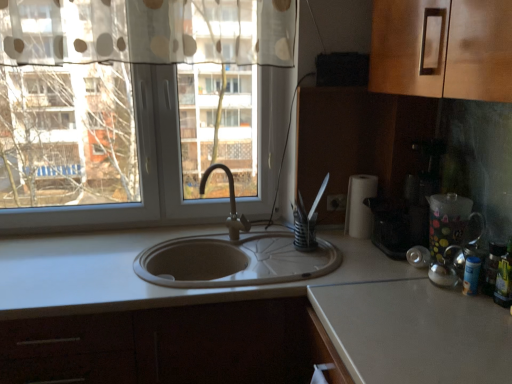
The width and height of the screenshot is (512, 384). What do you see at coordinates (408, 207) in the screenshot? I see `black plastic coffee machine at right` at bounding box center [408, 207].

I want to click on matte silver faucet at center, so click(x=230, y=203).

In the scene shown: In order to face matte silver faucet at center, should I rotate leftwards or rightwards?

You should look left and rotate roughly 4.015 degrees.

Locate an element on the screen. This screenshot has width=512, height=384. white matte countertop at center is located at coordinates (244, 318).

At what (x,y) coordinates should I click in order to perform the action: click on green glass bottle at right. Please return your answer as a coordinate pair (x, y). Looking at the image, I should click on [504, 279].

From the image's perspective, relative to white paper towel at right, is green glass bottle at right above or below?

Clearly, from the image's perspective, green glass bottle at right is below white paper towel at right.

Is green glass bottle at right not close to white paper towel at right?

No, green glass bottle at right is in close proximity to white paper towel at right.

Locate an element on the screen. The height and width of the screenshot is (384, 512). bottle below the white paper towel at right (from the image's perspective) is located at coordinates (504, 279).

From the picture: Which object is more forward, green glass bottle at right or white paper towel at right?

green glass bottle at right.

Consider the image. Could you tell me if white paper towel at right is turned towards matte silver faucet at center?

Yes, white paper towel at right is facing matte silver faucet at center.

Would you say white paper towel at right is outside matte silver faucet at center?

Indeed, white paper towel at right is completely outside matte silver faucet at center.

Is white paper towel at right with matte silver faucet at center?

No, white paper towel at right is not next to matte silver faucet at center.

Considering the sizes of objects white paper towel at right and matte silver faucet at center in the image provided, who is shorter, white paper towel at right or matte silver faucet at center?

With less height is white paper towel at right.

Locate an element on the screen. paper towel that appears behind the black plastic coffee machine at right is located at coordinates (360, 206).

Is white paper towel at right bigger than black plastic coffee machine at right?

No, white paper towel at right is not bigger than black plastic coffee machine at right.

Does white paper towel at right have a greater width compared to black plastic coffee machine at right?

Incorrect, the width of white paper towel at right does not surpass that of black plastic coffee machine at right.

Is white paper towel at right far away from black plastic coffee machine at right?

Actually, white paper towel at right and black plastic coffee machine at right are a little close together.

Is transparent plastic pitcher at right oriented away from white matte countertop at center?

No, transparent plastic pitcher at right is not facing the opposite direction of white matte countertop at center.

Does transparent plastic pitcher at right have a lesser height compared to white matte countertop at center?

Indeed, transparent plastic pitcher at right has a lesser height compared to white matte countertop at center.

Locate an element on the screen. This screenshot has height=384, width=512. countertop in front of the transparent plastic pitcher at right is located at coordinates (244, 318).

Can we say transparent plastic pitcher at right lies outside white matte countertop at center?

Yes, transparent plastic pitcher at right is not within white matte countertop at center.

Considering the relative sizes of white matte countertop at center and green glass bottle at right in the image provided, is white matte countertop at center taller than green glass bottle at right?

Correct, white matte countertop at center is much taller as green glass bottle at right.

Is white matte countertop at center next to green glass bottle at right and touching it?

They are not placed beside each other.

Based on their positions, is white matte countertop at center located to the left or right of green glass bottle at right?

white matte countertop at center is to the left of green glass bottle at right.

From the image's perspective, who appears lower, white matte countertop at center or green glass bottle at right?

white matte countertop at center appears lower in the image.

From a real-world perspective, who is located higher, green glass bottle at right or black plastic coffee machine at right?

black plastic coffee machine at right.

Which of these two, green glass bottle at right or black plastic coffee machine at right, stands taller?

black plastic coffee machine at right.

Is green glass bottle at right further to the viewer compared to black plastic coffee machine at right?

No, green glass bottle at right is closer to the viewer.

Where is `bottle that is in front of the black plastic coffee machine at right`? bottle that is in front of the black plastic coffee machine at right is located at coordinates (504, 279).

Can you tell me how much matte silver faucet at center and green glass bottle at right differ in facing direction?

The angular difference between matte silver faucet at center and green glass bottle at right is 12.3 degrees.

From a real-world perspective, between matte silver faucet at center and green glass bottle at right, who is vertically higher?

In real-world perspective, matte silver faucet at center is above.

From the image's perspective, who appears lower, matte silver faucet at center or green glass bottle at right?

green glass bottle at right is shown below in the image.

Is matte silver faucet at center not near green glass bottle at right?

That's not correct — matte silver faucet at center is a little close to green glass bottle at right.

Where is `bottle on the right side of white paper towel at right`? The width and height of the screenshot is (512, 384). bottle on the right side of white paper towel at right is located at coordinates (504, 279).

Locate an element on the screen. The width and height of the screenshot is (512, 384). tap to the left of white paper towel at right is located at coordinates (230, 203).

From the picture: Considering their positions, is black plastic coffee machine at right positioned further to white paper towel at right than green glass bottle at right?

green glass bottle at right.

From the image, which object appears to be nearer to white matte countertop at center, black plastic coffee machine at right or green glass bottle at right?

black plastic coffee machine at right is closer to white matte countertop at center.

Considering their positions, is white matte countertop at center positioned closer to green glass bottle at right than black plastic coffee machine at right?

black plastic coffee machine at right is positioned closer to the anchor green glass bottle at right.

From the image, which object appears to be nearer to green glass bottle at right, white paper towel at right or transparent plastic pitcher at right?

transparent plastic pitcher at right.

From the image, which object appears to be farther from white matte countertop at center, white paper towel at right or green glass bottle at right?

green glass bottle at right.

Which object lies further to the anchor point green glass bottle at right, transparent plastic pitcher at right or matte silver faucet at center?

Based on the image, matte silver faucet at center appears to be further to green glass bottle at right.

Estimate the real-world distances between objects in this image. Which object is closer to black plastic coffee machine at right, green glass bottle at right or matte silver faucet at center?

Based on the image, green glass bottle at right appears to be nearer to black plastic coffee machine at right.

Which object lies further to the anchor point white paper towel at right, white matte countertop at center or matte silver faucet at center?

white matte countertop at center is positioned further to the anchor white paper towel at right.

I want to click on appliance situated between matte silver faucet at center and green glass bottle at right from left to right, so click(447, 222).

Find the location of a particular element. Image resolution: width=512 pixels, height=384 pixels. tap between white matte countertop at center and green glass bottle at right in the horizontal direction is located at coordinates (230, 203).

Identify the location of paper towel between matte silver faucet at center and transparent plastic pitcher at right in the horizontal direction. This screenshot has height=384, width=512. (360, 206).

I want to click on paper towel between white matte countertop at center and transparent plastic pitcher at right from left to right, so click(360, 206).